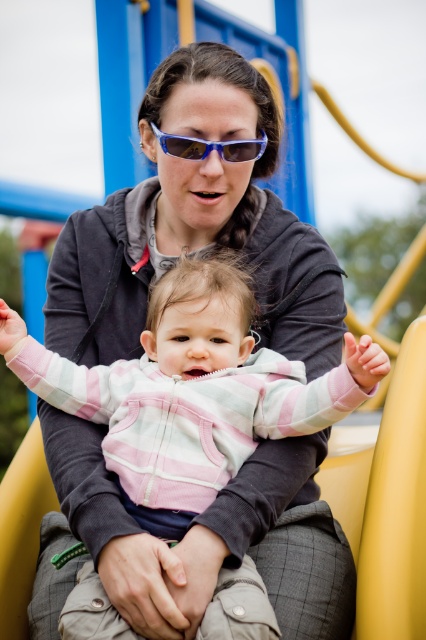
Who is taller, pink striped fleece at center or blue plastic goggles at center?

pink striped fleece at center is taller.

Who is more forward, (x=8, y=362) or (x=178, y=141)?

Positioned in front is point (x=8, y=362).

Identify the location of pink striped fleece at center. (192, 387).